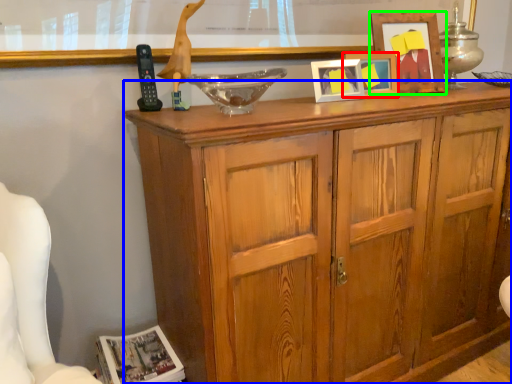
Question: Considering the real-world distances, which object is farthest from picture frame (highlighted by a red box)? cabinetry (highlighted by a blue box) or picture frame (highlighted by a green box)?

Choices:
 (A) cabinetry
 (B) picture frame

Answer: (A)